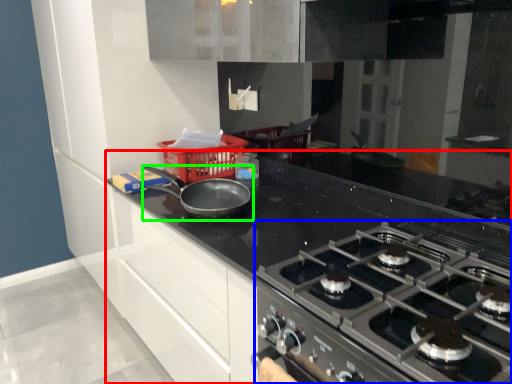
Question: Estimate the real-world distances between objects in this image. Which object is closer to countertop (highlighted by a red box), gas stove (highlighted by a blue box) or kitchen appliance (highlighted by a green box)?

Choices:
 (A) gas stove
 (B) kitchen appliance

Answer: (A)